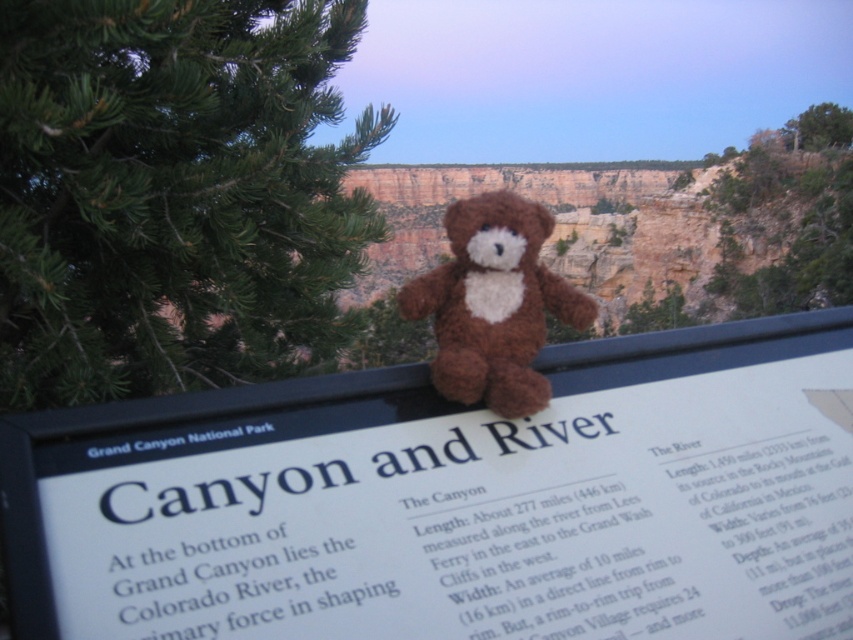
Question: Does white plastic sign at center have a smaller size compared to brown plush bear at center?

Choices:
 (A) no
 (B) yes

Answer: (A)

Question: Can you confirm if white plastic sign at center is positioned below green needle-like at upper left?

Choices:
 (A) no
 (B) yes

Answer: (B)

Question: Which of the following is the closest to the observer?

Choices:
 (A) (671, 419)
 (B) (463, 264)
 (C) (178, 54)

Answer: (A)

Question: Considering the real-world distances, which object is closest to the white plastic sign at center?

Choices:
 (A) green needle-like at upper left
 (B) brown plush bear at center

Answer: (B)

Question: Estimate the real-world distances between objects in this image. Which object is farther from the green needle-like at upper left?

Choices:
 (A) brown plush bear at center
 (B) white plastic sign at center

Answer: (B)

Question: Is green needle-like at upper left to the right of brown plush bear at center from the viewer's perspective?

Choices:
 (A) yes
 (B) no

Answer: (B)